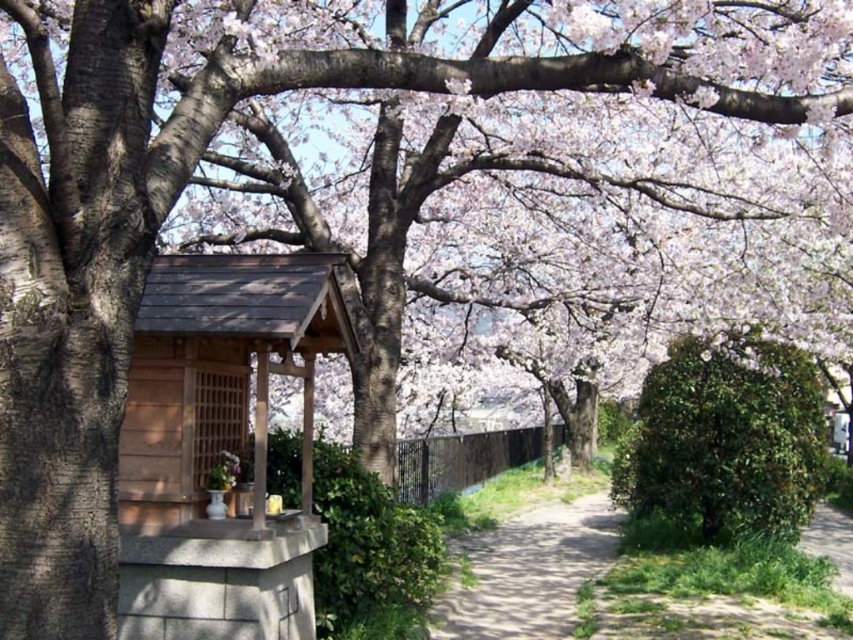
Question: Where is green leafy bush at center located in relation to dirt path at center in the image?

Choices:
 (A) above
 (B) below

Answer: (A)

Question: Which of the following is the closest to the observer?

Choices:
 (A) wooden gazebo at center
 (B) dirt path at lower right
 (C) dirt path at center
 (D) green leafy bush at center

Answer: (A)

Question: Is green leafy bush at center positioned behind dirt path at lower right?

Choices:
 (A) no
 (B) yes

Answer: (B)

Question: Which object appears closest to the camera in this image?

Choices:
 (A) green leafy bush at center
 (B) dirt path at center
 (C) wooden gazebo at center
 (D) dirt path at lower right

Answer: (C)

Question: Based on their relative distances, which object is nearer to the green leafy bush at center?

Choices:
 (A) wooden gazebo at center
 (B) dirt path at lower right

Answer: (B)

Question: Observing the image, what is the correct spatial positioning of green leafy bush at center in reference to dirt path at center?

Choices:
 (A) below
 (B) above

Answer: (B)